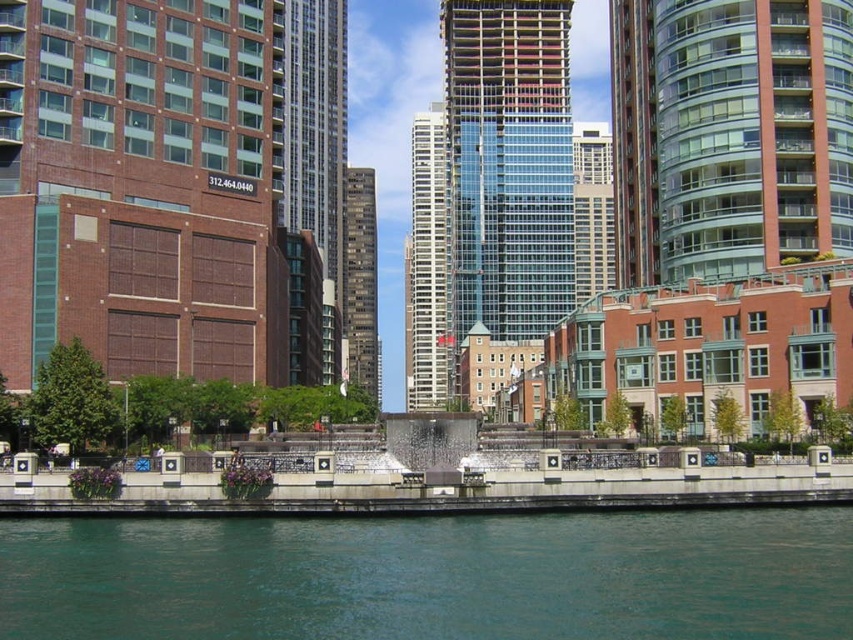
Question: Which point is closer to the camera?

Choices:
 (A) glassy steel skyscraper at center
 (B) dark gray concrete building at center
 (C) white glass building at center
 (D) glassy reflective skyscraper at center

Answer: (A)

Question: Does glassy steel skyscraper at center come in front of white glass building at center?

Choices:
 (A) yes
 (B) no

Answer: (A)

Question: Which of the following is the farthest from the observer?

Choices:
 (A) green water at lower center
 (B) glassy steel skyscraper at center

Answer: (B)

Question: From the image, what is the correct spatial relationship of green water at lower center in relation to glassy steel skyscraper at center?

Choices:
 (A) right
 (B) left

Answer: (A)

Question: Which of these objects is positioned farthest from the white glass building at center?

Choices:
 (A) glassy reflective skyscraper at center
 (B) green water at lower center

Answer: (B)

Question: Can you confirm if green water at lower center is positioned to the left of glassy steel skyscraper at center?

Choices:
 (A) yes
 (B) no

Answer: (B)